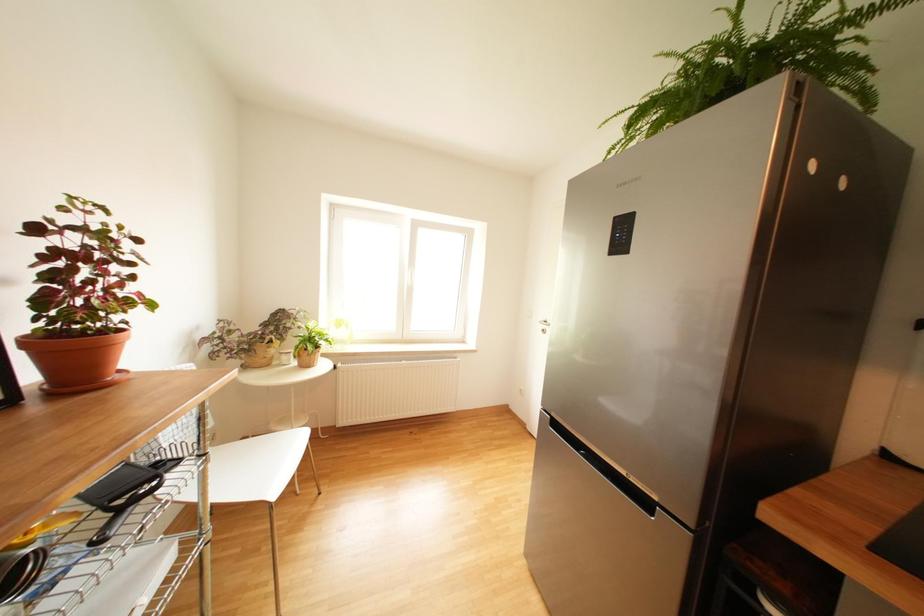
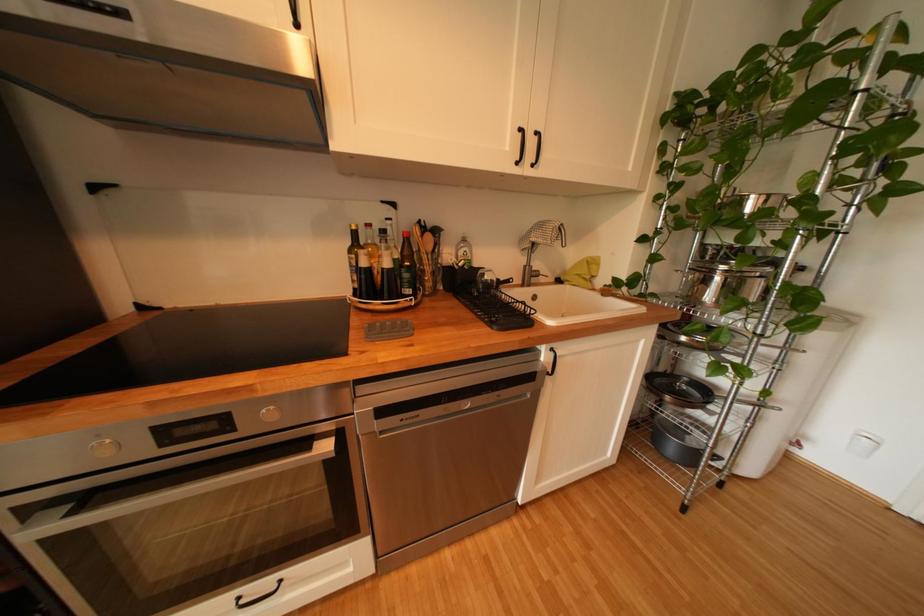
Based on the continuous images, in which direction is the camera rotating?

The camera rotated toward right-down.